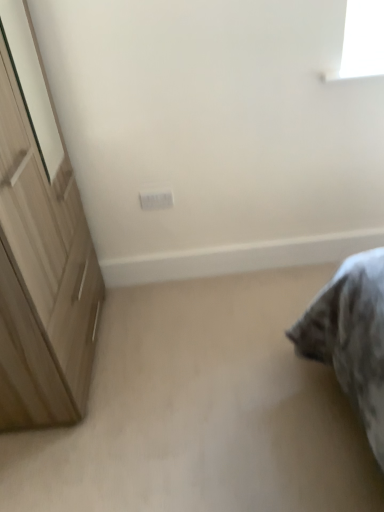
At what (x,y) coordinates should I click in order to perform the action: click on white plastic electric outlet at center. Please return your answer as a coordinate pair (x, y). Looking at the image, I should click on (156, 199).

Identify the location of white plastic electric outlet at center. The height and width of the screenshot is (512, 384). (156, 199).

Is light brown wooden cupboard at left at the left side of white plastic electric outlet at center?

Yes.

In the scene shown: Is light brown wooden cupboard at left facing away from white plastic electric outlet at center?

That's not correct — light brown wooden cupboard at left is not looking away from white plastic electric outlet at center.

Considering the sizes of light brown wooden cupboard at left and white plastic electric outlet at center in the image, is light brown wooden cupboard at left wider or thinner than white plastic electric outlet at center?

light brown wooden cupboard at left is wider than white plastic electric outlet at center.

How different are the orientations of beige carpet at lower right and light brown wooden cupboard at left in degrees?

There is a 88.5-degree angle between the facing directions of beige carpet at lower right and light brown wooden cupboard at left.

Is beige carpet at lower right next to light brown wooden cupboard at left and touching it?

beige carpet at lower right is not next to light brown wooden cupboard at left, and they're not touching.

From a real-world perspective, who is located higher, beige carpet at lower right or light brown wooden cupboard at left?

light brown wooden cupboard at left, from a real-world perspective.

Is light brown wooden cupboard at left beside beige carpet at lower right?

No, light brown wooden cupboard at left is not with beige carpet at lower right.

From a real-world perspective, relative to beige carpet at lower right, is light brown wooden cupboard at left vertically above or below?

In terms of real-world spatial position, light brown wooden cupboard at left is above beige carpet at lower right.

Is light brown wooden cupboard at left positioned beyond the bounds of beige carpet at lower right?

Yes, light brown wooden cupboard at left is located beyond the bounds of beige carpet at lower right.

Is white plastic electric outlet at center inside or outside of light brown wooden cupboard at left?

The correct answer is: outside.

From a real-world perspective, is white plastic electric outlet at center above or below light brown wooden cupboard at left?

white plastic electric outlet at center is situated lower than light brown wooden cupboard at left in the real world.

Based on the photo, between beige carpet at lower right and white plastic electric outlet at center, which one has smaller size?

white plastic electric outlet at center is smaller.

In the image, is beige carpet at lower right positioned in front of or behind white plastic electric outlet at center?

In the image, beige carpet at lower right appears in front of white plastic electric outlet at center.

Is beige carpet at lower right not close to white plastic electric outlet at center?

No, beige carpet at lower right is not far from white plastic electric outlet at center.

Is beige carpet at lower right taller or shorter than white plastic electric outlet at center?

In the image, beige carpet at lower right appears to be shorter than white plastic electric outlet at center.

Between white plastic electric outlet at center and beige carpet at lower right, which one has smaller width?

white plastic electric outlet at center.

Looking at the image, does white plastic electric outlet at center seem bigger or smaller compared to beige carpet at lower right?

Considering their sizes, white plastic electric outlet at center takes up less space than beige carpet at lower right.

Measure the distance from white plastic electric outlet at center to beige carpet at lower right.

A distance of 33.94 inches exists between white plastic electric outlet at center and beige carpet at lower right.

Which is more to the right, white plastic electric outlet at center or beige carpet at lower right?

From the viewer's perspective, beige carpet at lower right appears more on the right side.

You are a GUI agent. You are given a task and a screenshot of the screen. Output one action in this format:
    pyautogui.click(x=<x>, y=<y>)
    Task: Click on the cupboard that is on the left side of white plastic electric outlet at center
    This screenshot has height=512, width=384.
    Given the screenshot: What is the action you would take?
    pyautogui.click(x=40, y=247)

Find the location of a particular element. The height and width of the screenshot is (512, 384). plain behind the light brown wooden cupboard at left is located at coordinates (202, 410).

Estimate the real-world distances between objects in this image. Which object is further from light brown wooden cupboard at left, white plastic electric outlet at center or beige carpet at lower right?

white plastic electric outlet at center.

Which object lies nearer to the anchor point beige carpet at lower right, white plastic electric outlet at center or light brown wooden cupboard at left?

light brown wooden cupboard at left lies closer to beige carpet at lower right than the other object.

From the image, which object appears to be farther from white plastic electric outlet at center, beige carpet at lower right or light brown wooden cupboard at left?

Based on the image, beige carpet at lower right appears to be further to white plastic electric outlet at center.

Looking at the image, which one is located closer to white plastic electric outlet at center, light brown wooden cupboard at left or beige carpet at lower right?

light brown wooden cupboard at left is positioned closer to the anchor white plastic electric outlet at center.

From the image, which object appears to be farther from light brown wooden cupboard at left, beige carpet at lower right or white plastic electric outlet at center?

white plastic electric outlet at center is further to light brown wooden cupboard at left.

Based on the photo, which object lies further to the anchor point beige carpet at lower right, light brown wooden cupboard at left or white plastic electric outlet at center?

Among the two, white plastic electric outlet at center is located further to beige carpet at lower right.

You are a GUI agent. You are given a task and a screenshot of the screen. Output one action in this format:
    pyautogui.click(x=<x>, y=<y>)
    Task: Click on the plain between light brown wooden cupboard at left and white plastic electric outlet at center from front to back
    This screenshot has height=512, width=384.
    Given the screenshot: What is the action you would take?
    pyautogui.click(x=202, y=410)